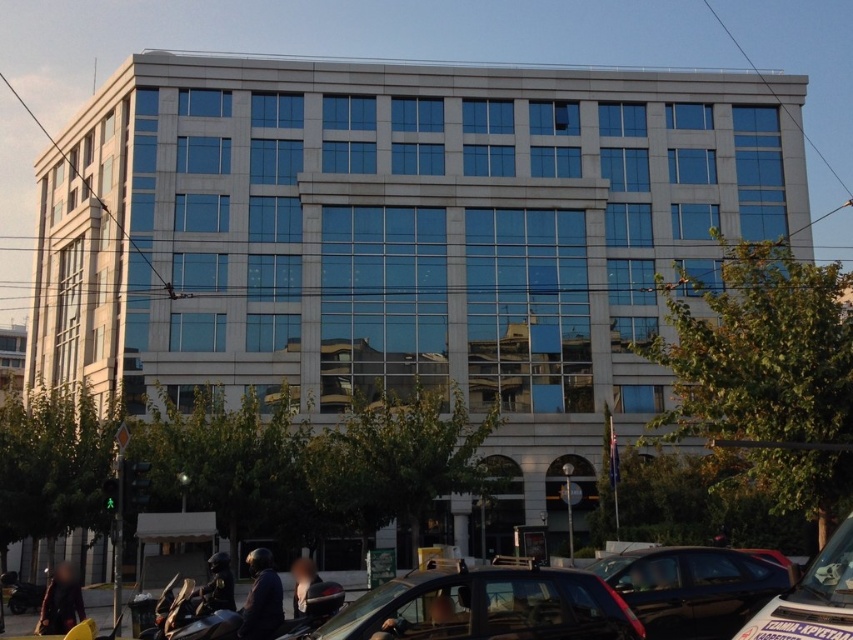
Who is higher up, matte black car at center or dark blue leather jacket at lower left?

Positioned higher is matte black car at center.

Does matte black car at center appear under dark blue leather jacket at lower left?

No, matte black car at center is not below dark blue leather jacket at lower left.

Which is behind, point (492, 586) or point (263, 577)?

Positioned behind is point (263, 577).

What are the coordinates of `matte black car at center` in the screenshot? It's located at [486, 605].

What do you see at coordinates (692, 588) in the screenshot? This screenshot has height=640, width=853. I see `glossy black car at lower right` at bounding box center [692, 588].

Is point (730, 568) less distant than point (212, 600)?

Yes.

Locate an element on the screen. The width and height of the screenshot is (853, 640). glossy black car at lower right is located at coordinates (692, 588).

Is dark blue leather jacket at lower left smaller than shiny black helmet at lower center?

Incorrect, dark blue leather jacket at lower left is not smaller in size than shiny black helmet at lower center.

Who is lower down, dark blue leather jacket at lower left or shiny black helmet at lower center?

dark blue leather jacket at lower left is lower down.

Measure the distance between dark blue leather jacket at lower left and camera.

dark blue leather jacket at lower left and camera are 56.44 feet apart.

Locate an element on the screen. This screenshot has width=853, height=640. dark blue leather jacket at lower left is located at coordinates (260, 598).